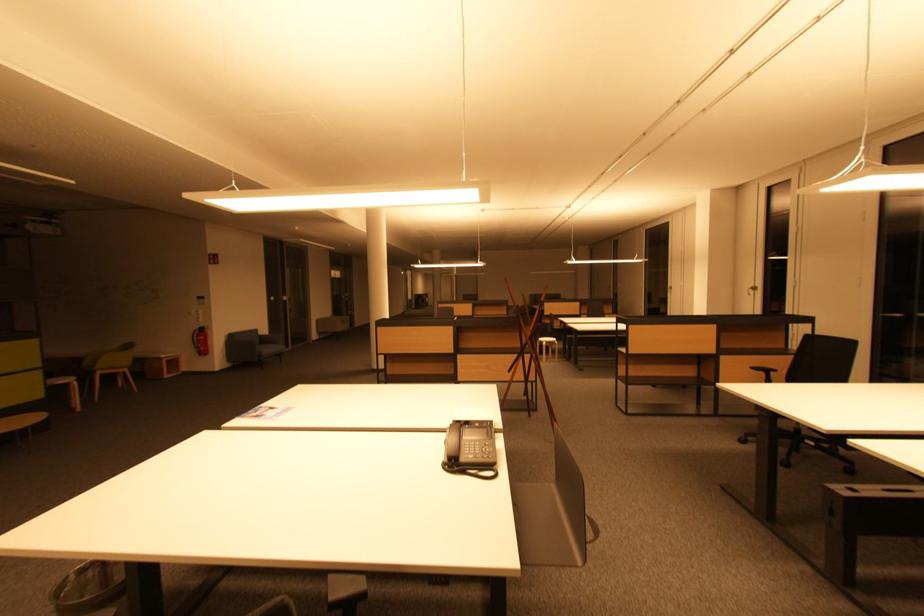
Where would you lift the wire mesh wastebasket? Please return your answer as a coordinate pair (x, y).

(88, 588)